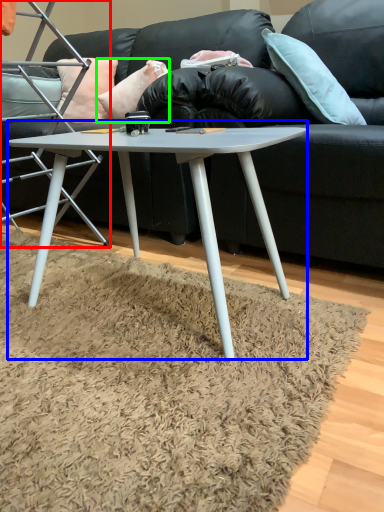
Question: Based on their relative distances, which object is farther from chair (highlighted by a red box)? Choose from coffee table (highlighted by a blue box) and pillow (highlighted by a green box).

Choices:
 (A) coffee table
 (B) pillow

Answer: (A)